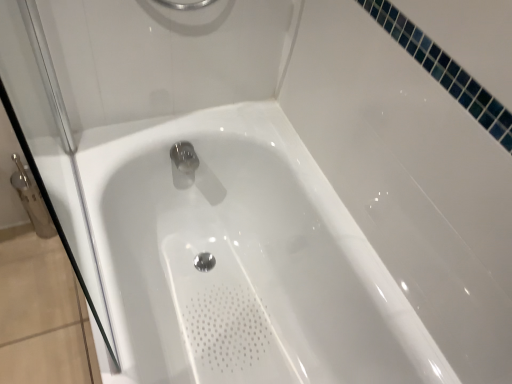
Question: From a real-world perspective, is transparent glass shower door at left above or below white glossy bathtub at center?

Choices:
 (A) above
 (B) below

Answer: (A)

Question: In terms of width, does transparent glass shower door at left look wider or thinner when compared to white glossy bathtub at center?

Choices:
 (A) wide
 (B) thin

Answer: (B)

Question: From the image's perspective, is transparent glass shower door at left located above or below white glossy bathtub at center?

Choices:
 (A) above
 (B) below

Answer: (A)

Question: Looking at the image, does white glossy bathtub at center seem bigger or smaller compared to transparent glass shower door at left?

Choices:
 (A) small
 (B) big

Answer: (B)

Question: Do you think white glossy bathtub at center is within transparent glass shower door at left, or outside of it?

Choices:
 (A) outside
 (B) inside

Answer: (A)

Question: From a real-world perspective, is white glossy bathtub at center physically located above or below transparent glass shower door at left?

Choices:
 (A) below
 (B) above

Answer: (A)

Question: From the image's perspective, relative to transparent glass shower door at left, is white glossy bathtub at center above or below?

Choices:
 (A) above
 (B) below

Answer: (B)